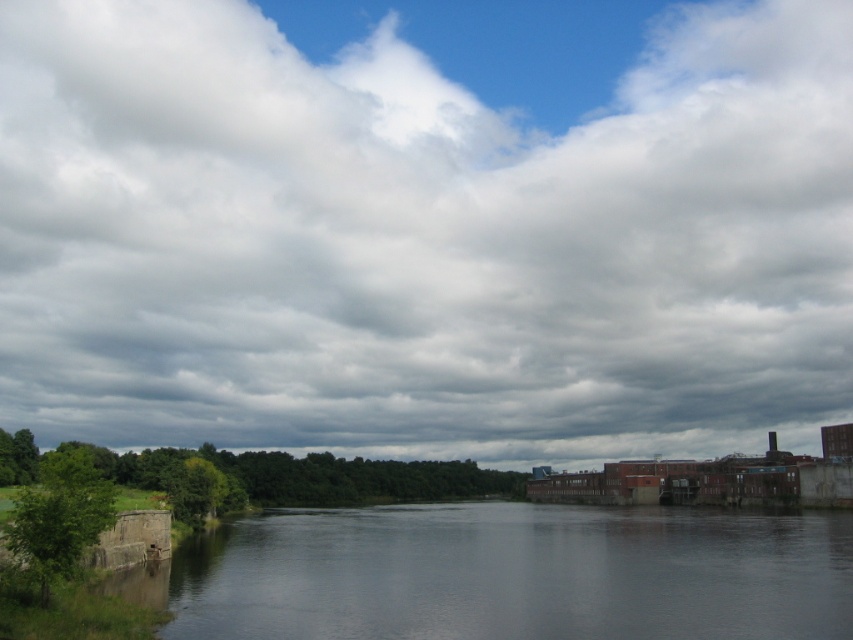
Question: Which of the following is the farthest from the observer?

Choices:
 (A) (427, 528)
 (B) (39, 314)

Answer: (B)

Question: Does cloudy sky at upper center have a smaller size compared to dark gray concrete river at center?

Choices:
 (A) yes
 (B) no

Answer: (B)

Question: Which point is farther to the camera?

Choices:
 (A) cloudy sky at upper center
 (B) dark gray concrete river at center

Answer: (A)

Question: Does cloudy sky at upper center have a smaller size compared to dark gray concrete river at center?

Choices:
 (A) yes
 (B) no

Answer: (B)

Question: Does cloudy sky at upper center appear on the right side of dark gray concrete river at center?

Choices:
 (A) yes
 (B) no

Answer: (A)